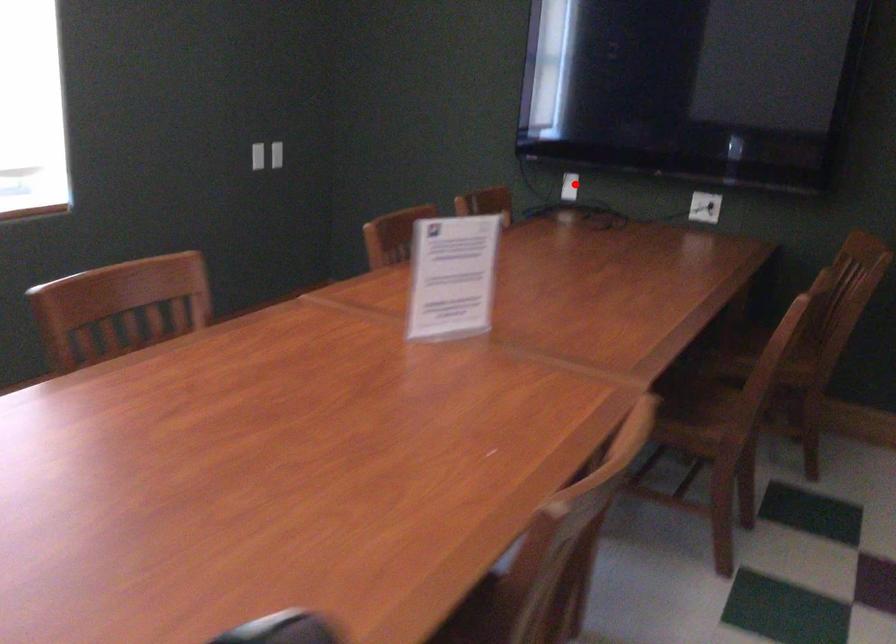
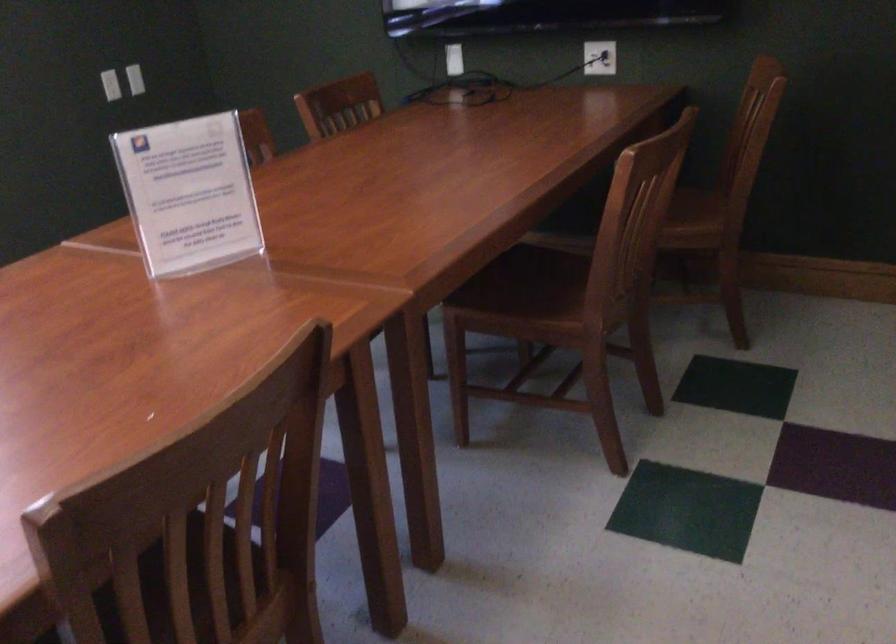
The point at the highlighted location is marked in the first image. Where is the corresponding point in the second image?

(453, 59)